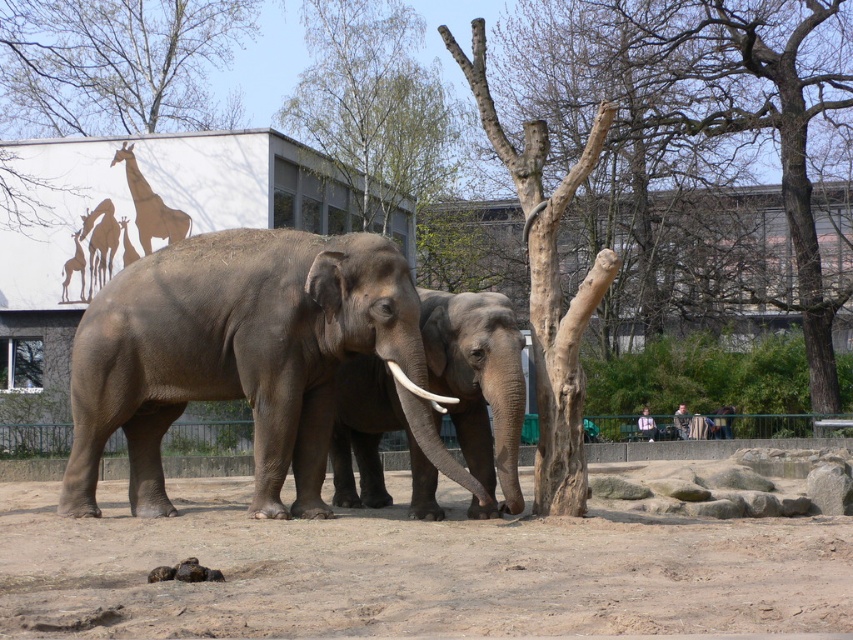
Question: Observing the image, what is the correct spatial positioning of bare branches at upper left in reference to bare wood tree at upper center?

Choices:
 (A) below
 (B) above

Answer: (B)

Question: Which point is closer to the camera?

Choices:
 (A) (146, 64)
 (B) (830, 99)

Answer: (B)

Question: Can you confirm if bare wood trunk at center is wider than bare branches at upper left?

Choices:
 (A) yes
 (B) no

Answer: (B)

Question: From the image, what is the correct spatial relationship of bare branches at upper left in relation to gray matte elephant at center?

Choices:
 (A) right
 (B) left

Answer: (B)

Question: Which point appears closest to the camera in this image?

Choices:
 (A) (247, 236)
 (B) (357, 371)

Answer: (A)

Question: Which of these objects is positioned farthest from the bare wood tree at upper center?

Choices:
 (A) light brown leather jacket at lower right
 (B) white matte tusk at center

Answer: (B)